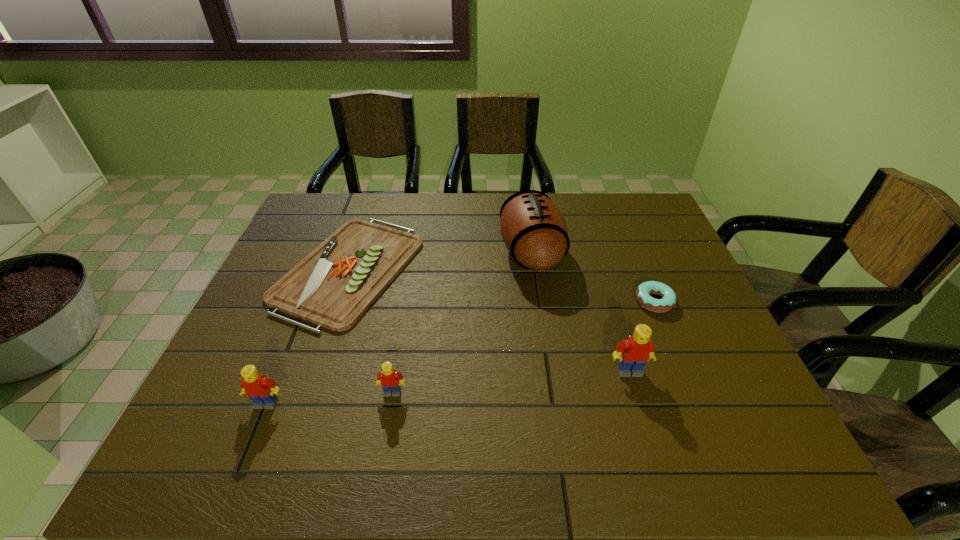
Where is `free space located 0.390m on the front of the third object from right to left`? This screenshot has height=540, width=960. free space located 0.390m on the front of the third object from right to left is located at coordinates (553, 414).

You are a GUI agent. You are given a task and a screenshot of the screen. Output one action in this format:
    pyautogui.click(x=<x>, y=<y>)
    Task: Click on the vacant position located 0.190m on the right of the chopping board
    The height and width of the screenshot is (540, 960).
    Given the screenshot: What is the action you would take?
    pyautogui.click(x=485, y=269)

Locate an element on the screen. This screenshot has width=960, height=540. vacant space situated on the left of the doughnut is located at coordinates (615, 301).

Find the location of a particular element. This screenshot has height=540, width=960. football (American) located in the far edge section of the desktop is located at coordinates (534, 231).

What are the coordinates of `chopping board that is at the far edge` in the screenshot? It's located at (333, 286).

The width and height of the screenshot is (960, 540). I want to click on Lego positioned at the left edge, so click(x=262, y=391).

Where is `chopping board that is at the left edge`? This screenshot has height=540, width=960. chopping board that is at the left edge is located at coordinates (333, 286).

This screenshot has height=540, width=960. I want to click on object that is at the right edge, so click(x=668, y=301).

The height and width of the screenshot is (540, 960). In order to click on object that is at the far left corner in this screenshot , I will do `click(333, 286)`.

Locate an element on the screen. This screenshot has height=540, width=960. object that is at the near left corner is located at coordinates (262, 391).